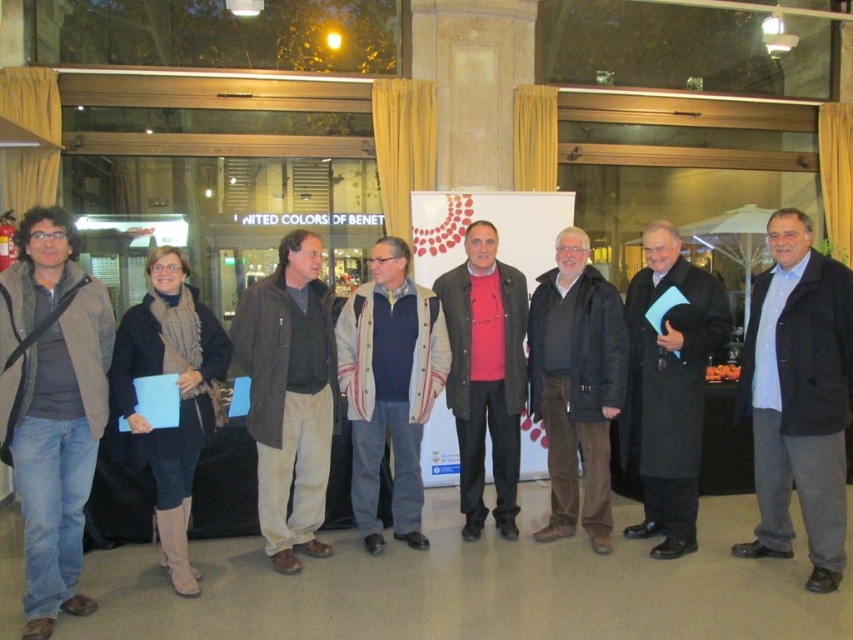
Question: Does blue cotton shirt at center have a greater width compared to pink matte sweater at center?

Choices:
 (A) no
 (B) yes

Answer: (A)

Question: Which object appears farthest from the camera in this image?

Choices:
 (A) blue cotton shirt at center
 (B) brown corduroy jacket at center
 (C) black wool coat at center

Answer: (C)

Question: Which object appears closest to the camera in this image?

Choices:
 (A) pink matte sweater at center
 (B) knitted wool sweater at center
 (C) brown corduroy jacket at center

Answer: (C)

Question: From the image, what is the correct spatial relationship of blue cotton shirt at center in relation to brown corduroy pants at center?

Choices:
 (A) above
 (B) below

Answer: (A)

Question: Estimate the real-world distances between objects in this image. Which object is farther from the denim jeans at left?

Choices:
 (A) pink matte sweater at center
 (B) brown corduroy jacket at center

Answer: (A)

Question: From the image, what is the correct spatial relationship of blue cotton shirt at center in relation to black wool coat at center?

Choices:
 (A) right
 (B) left

Answer: (A)